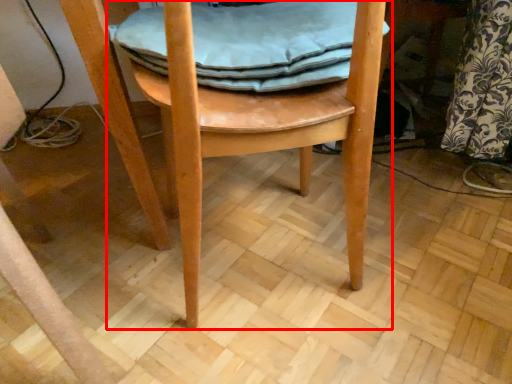
Question: From the image's perspective, what is the correct spatial positioning of chair (annotated by the red box) in reference to material?

Choices:
 (A) above
 (B) below

Answer: (B)